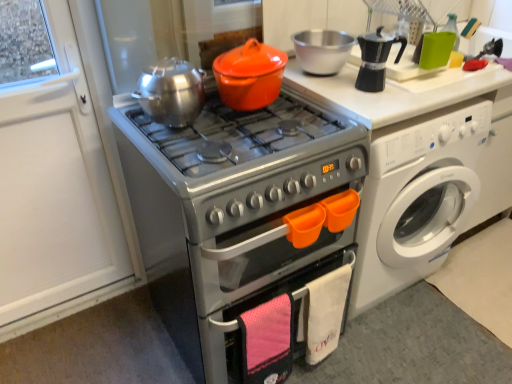
Question: Is there a large distance between brushed metal tea pot at upper center and white glossy washing machine at right?

Choices:
 (A) yes
 (B) no

Answer: (B)

Question: Is brushed metal tea pot at upper center looking in the opposite direction of white glossy washing machine at right?

Choices:
 (A) yes
 (B) no

Answer: (B)

Question: From the image's perspective, does brushed metal tea pot at upper center appear lower than white glossy washing machine at right?

Choices:
 (A) yes
 (B) no

Answer: (B)

Question: Does brushed metal tea pot at upper center have a smaller size compared to white glossy washing machine at right?

Choices:
 (A) no
 (B) yes

Answer: (B)

Question: Does brushed metal tea pot at upper center appear on the right side of white glossy washing machine at right?

Choices:
 (A) yes
 (B) no

Answer: (B)

Question: From a real-world perspective, is brushed metal tea pot at upper center physically above white glossy washing machine at right?

Choices:
 (A) yes
 (B) no

Answer: (A)

Question: Is silver metallic oven at center far away from orange matte crock pot at center?

Choices:
 (A) yes
 (B) no

Answer: (B)

Question: Can we say silver metallic oven at center lies outside orange matte crock pot at center?

Choices:
 (A) no
 (B) yes

Answer: (B)

Question: Considering the relative positions of silver metallic oven at center and orange matte crock pot at center in the image provided, is silver metallic oven at center to the right of orange matte crock pot at center from the viewer's perspective?

Choices:
 (A) yes
 (B) no

Answer: (B)

Question: Is silver metallic oven at center thinner than orange matte crock pot at center?

Choices:
 (A) yes
 (B) no

Answer: (B)

Question: Is silver metallic oven at center facing away from orange matte crock pot at center?

Choices:
 (A) no
 (B) yes

Answer: (A)

Question: Is silver metallic oven at center taller than orange matte crock pot at center?

Choices:
 (A) no
 (B) yes

Answer: (B)

Question: Is white glossy washing machine at right shorter than brushed metal tea pot at upper center?

Choices:
 (A) no
 (B) yes

Answer: (A)